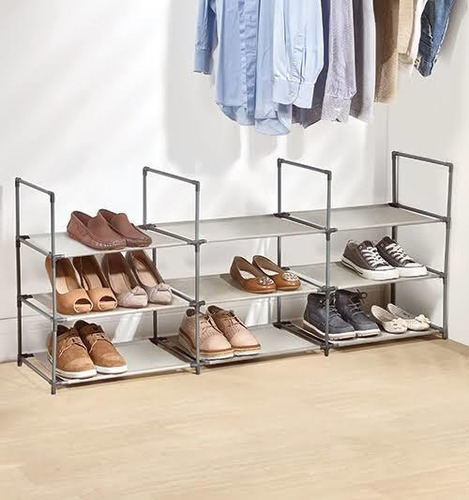
Image resolution: width=469 pixels, height=500 pixels. In order to click on shoes on middle shelf in this screenshot , I will do `click(75, 299)`, `click(101, 297)`, `click(132, 298)`, `click(158, 297)`, `click(264, 281)`, `click(293, 284)`, `click(371, 267)`, `click(404, 267)`.